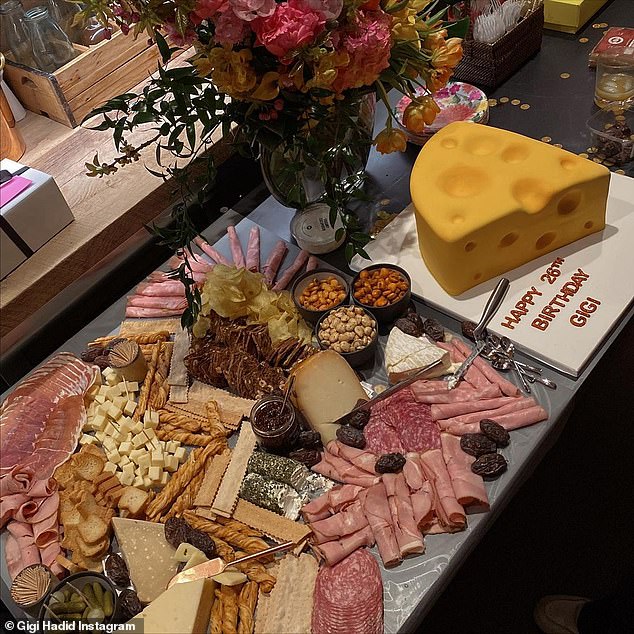
Locate an element on the screen. This screenshot has height=634, width=634. utensils is located at coordinates pos(390,392), pos(268,550), pos(482,318), pos(288,394).